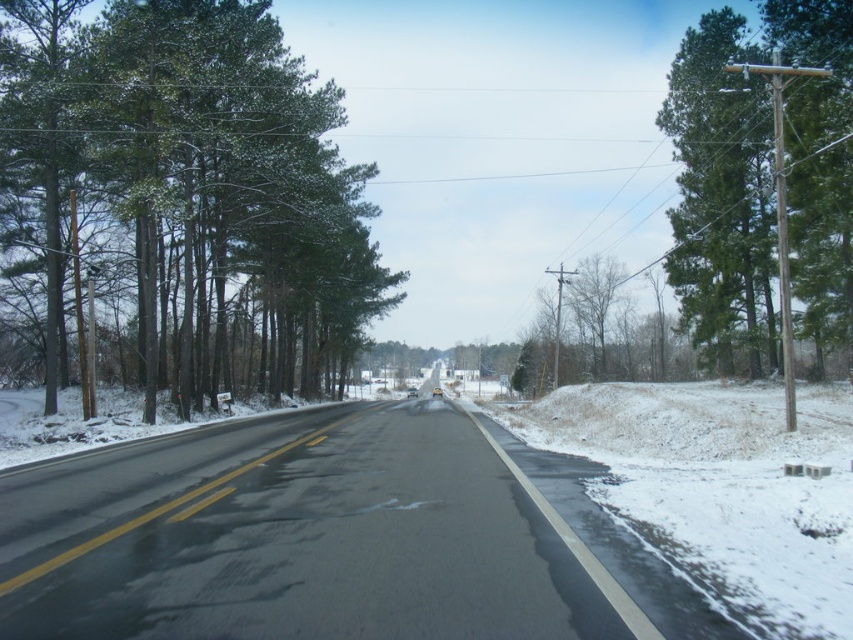
You are a driver approaching the road and notice the green matte trees at left and the green matte tree at right. Which group of trees is closer to you?

The green matte trees at left is positioned over green matte tree at right, so the green matte trees at left are closer to you.

You are driving along the black asphalt road at center and need to park your car on the side. Which side should you choose to avoid the dense green matte trees at left?

You should park on the right side of the black asphalt road at center because the green matte trees at left are located to the left of the road, leaving the right side less dense and more open for parking.

You are driving a car and need to park it between the black asphalt road at center and the green matte tree at right. Which one is closer to you so you can park next to it?

The black asphalt road at center has a lesser height compared to the green matte tree at right, so the road is closer to you. You can park next to the black asphalt road at center.